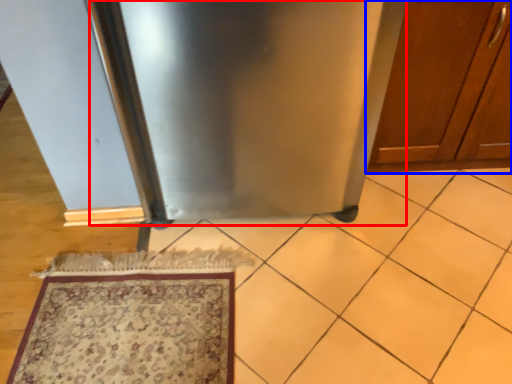
Question: Which of the following is the closest to the observer, appliance (highlighted by a red box) or cabinetry (highlighted by a blue box)?

Choices:
 (A) appliance
 (B) cabinetry

Answer: (A)